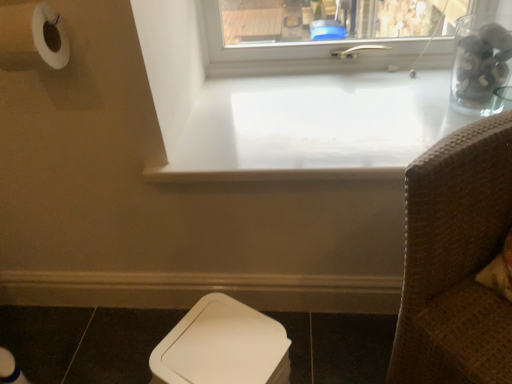
Question: From the image's perspective, is dark brown tile at lower left located above white plastic toilet bowl at lower center?

Choices:
 (A) no
 (B) yes

Answer: (A)

Question: Considering the relative sizes of dark brown tile at lower left and white plastic toilet bowl at lower center in the image provided, is dark brown tile at lower left shorter than white plastic toilet bowl at lower center?

Choices:
 (A) yes
 (B) no

Answer: (B)

Question: Is dark brown tile at lower left oriented towards white plastic toilet bowl at lower center?

Choices:
 (A) no
 (B) yes

Answer: (A)

Question: Is white plastic toilet bowl at lower center inside dark brown tile at lower left?

Choices:
 (A) yes
 (B) no

Answer: (B)

Question: From a real-world perspective, is dark brown tile at lower left located higher than white plastic toilet bowl at lower center?

Choices:
 (A) no
 (B) yes

Answer: (A)

Question: Is the depth of dark brown tile at lower left less than that of white plastic toilet bowl at lower center?

Choices:
 (A) yes
 (B) no

Answer: (B)

Question: Is white glossy counter top at center positioned behind transparent glass jar at upper right?

Choices:
 (A) no
 (B) yes

Answer: (A)

Question: From the image's perspective, is white glossy counter top at center under transparent glass jar at upper right?

Choices:
 (A) no
 (B) yes

Answer: (B)

Question: Is transparent glass jar at upper right at the back of white glossy counter top at center?

Choices:
 (A) no
 (B) yes

Answer: (A)

Question: From the image's perspective, is white glossy counter top at center on top of transparent glass jar at upper right?

Choices:
 (A) no
 (B) yes

Answer: (A)

Question: Can you confirm if white glossy counter top at center is wider than transparent glass jar at upper right?

Choices:
 (A) no
 (B) yes

Answer: (B)

Question: Is white glossy counter top at center facing towards transparent glass jar at upper right?

Choices:
 (A) yes
 (B) no

Answer: (B)

Question: Is brown woven chair at right positioned with its back to clear glass jar at upper right?

Choices:
 (A) no
 (B) yes

Answer: (A)